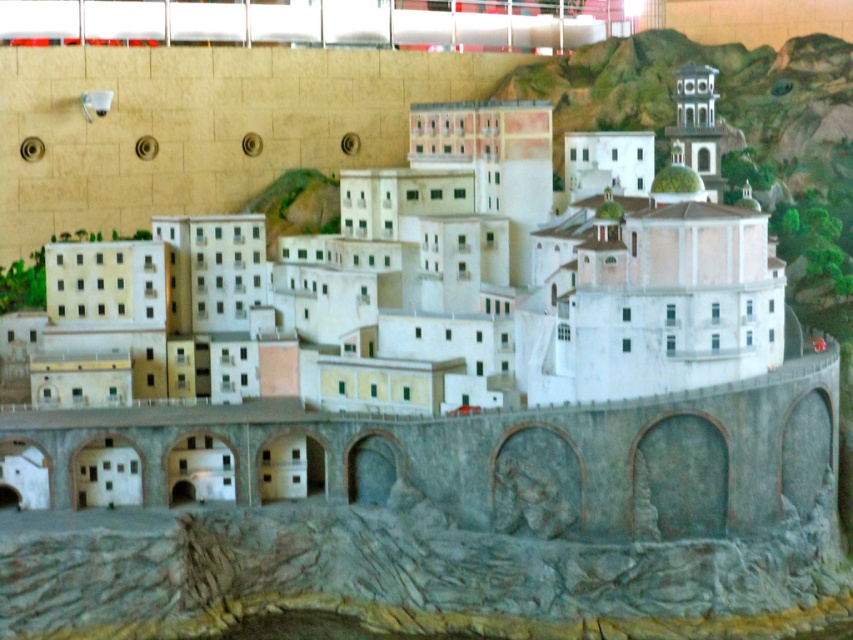
Does point (438, 273) come in front of point (483, 493)?

No.

Who is more distant from viewer, (688, 312) or (653, 493)?

Positioned behind is point (688, 312).

The image size is (853, 640). What do you see at coordinates (450, 278) in the screenshot? I see `white matte building at center` at bounding box center [450, 278].

Locate an element on the screen. The width and height of the screenshot is (853, 640). white matte building at center is located at coordinates (450, 278).